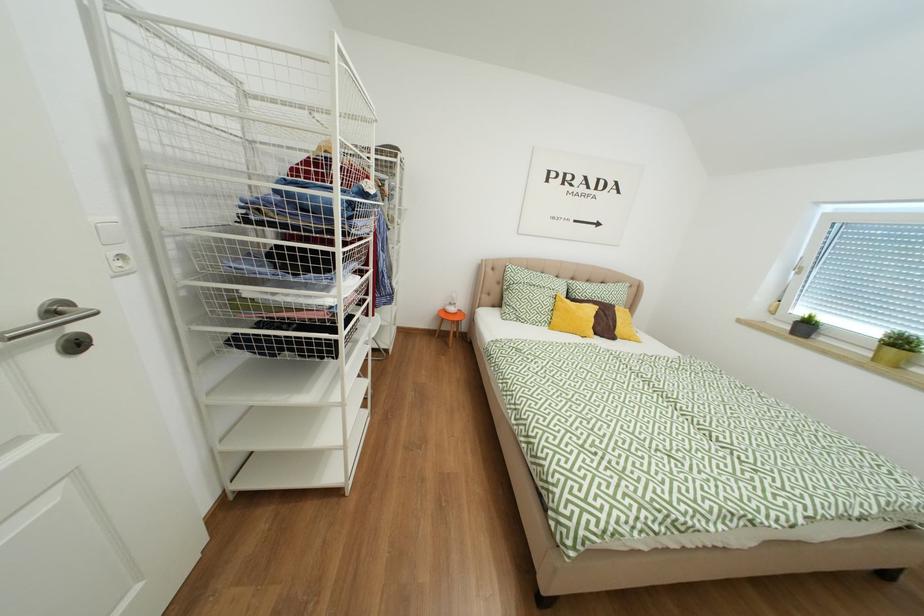
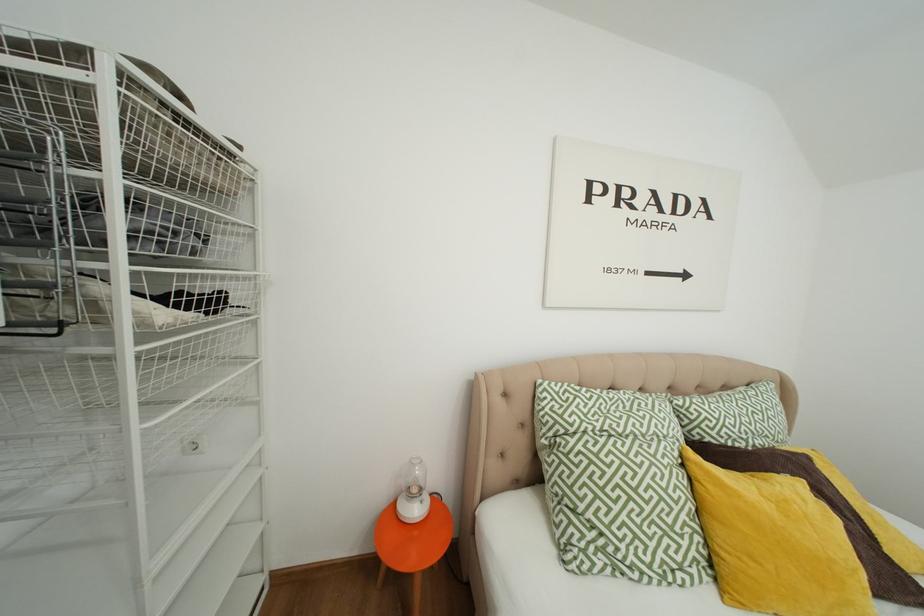
Question: What movement of the cameraman would produce the second image?

Choices:
 (A) Left
 (B) Right
 (C) Forward
 (D) Backward

Answer: (C)